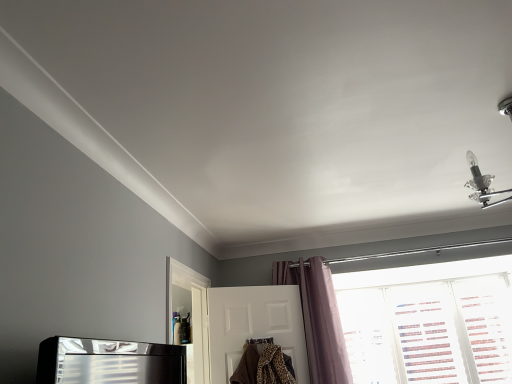
This screenshot has height=384, width=512. What do you see at coordinates (188, 316) in the screenshot?
I see `transparent plastic screen door at lower left` at bounding box center [188, 316].

Describe the element at coordinates (254, 326) in the screenshot. This screenshot has height=384, width=512. I see `white matte door at center` at that location.

Where is `transparent plastic screen door at lower left`? The height and width of the screenshot is (384, 512). transparent plastic screen door at lower left is located at coordinates (188, 316).

Is the depth of purple velvet curtain at center greater than that of transparent plastic screen door at lower left?

Yes, it is.

How different are the orientations of purple velvet curtain at center and transparent plastic screen door at lower left in degrees?

purple velvet curtain at center and transparent plastic screen door at lower left are facing 89.8 degrees away from each other.

Is purple velvet curtain at center situated inside transparent plastic screen door at lower left or outside?

purple velvet curtain at center cannot be found inside transparent plastic screen door at lower left.

Does purple velvet curtain at center have a smaller size compared to transparent plastic screen door at lower left?

No.

Is white matte door at center turned away from transparent plastic screen door at lower left?

No, white matte door at center's orientation is not away from transparent plastic screen door at lower left.

Which is more to the right, white matte door at center or transparent plastic screen door at lower left?

white matte door at center is more to the right.

From the image's perspective, is white matte door at center under transparent plastic screen door at lower left?

Indeed, from the image's perspective, white matte door at center is shown beneath transparent plastic screen door at lower left.

From the picture: From a real-world perspective, is white matte door at center physically located above or below white textured blinds at lower right?

white matte door at center is above white textured blinds at lower right.

How distant is white matte door at center from white textured blinds at lower right?

white matte door at center is 1.39 meters away from white textured blinds at lower right.

Does white matte door at center lie in front of white textured blinds at lower right?

That is True.

In the scene shown: From the image's perspective, is white matte door at center on white textured blinds at lower right?

Yes, from the image's perspective, white matte door at center is above white textured blinds at lower right.

At what (x,y) coordinates should I click in order to perform the action: click on window below the purple velvet curtain at center (from the image's perspective). Please return your answer as a coordinate pair (x, y). Looking at the image, I should click on (429, 322).

Could white textured blinds at lower right be considered to be inside purple velvet curtain at center?

That's incorrect, white textured blinds at lower right is not inside purple velvet curtain at center.

Is purple velvet curtain at center taller than white textured blinds at lower right?

No.

Is white matte door at center at the back of white textured blinds at lower right?

That's not correct — white textured blinds at lower right is not looking away from white matte door at center.

Considering the sizes of objects white textured blinds at lower right and white matte door at center in the image provided, who is thinner, white textured blinds at lower right or white matte door at center?

white textured blinds at lower right is thinner.

In terms of height, does white textured blinds at lower right look taller or shorter compared to white matte door at center?

Clearly, white textured blinds at lower right is taller compared to white matte door at center.

Locate an element on the screen. window below the transparent plastic screen door at lower left (from a real-world perspective) is located at coordinates (429, 322).

How different are the orientations of transparent plastic screen door at lower left and white textured blinds at lower right in degrees?

The facing directions of transparent plastic screen door at lower left and white textured blinds at lower right are 89.4 degrees apart.

Looking at the image, does transparent plastic screen door at lower left seem bigger or smaller compared to white textured blinds at lower right?

transparent plastic screen door at lower left is smaller than white textured blinds at lower right.

Is transparent plastic screen door at lower left not within white textured blinds at lower right?

Yes, transparent plastic screen door at lower left is not within white textured blinds at lower right.

Does white textured blinds at lower right appear on the left side of purple velvet curtain at center?

In fact, white textured blinds at lower right is to the right of purple velvet curtain at center.

The height and width of the screenshot is (384, 512). Identify the location of window on the right side of purple velvet curtain at center. (429, 322).

Is white textured blinds at lower right completely or partially outside of purple velvet curtain at center?

That's correct, white textured blinds at lower right is outside of purple velvet curtain at center.

Which of these two, white textured blinds at lower right or purple velvet curtain at center, is bigger?

purple velvet curtain at center.

The width and height of the screenshot is (512, 384). In order to click on curtain on the right of the transparent plastic screen door at lower left in this screenshot , I will do `click(318, 318)`.

Where is `screen door on the left of white matte door at center`? The width and height of the screenshot is (512, 384). screen door on the left of white matte door at center is located at coordinates (188, 316).

From the image, which object appears to be nearer to purple velvet curtain at center, transparent plastic screen door at lower left or white textured blinds at lower right?

transparent plastic screen door at lower left is closer to purple velvet curtain at center.

Considering their positions, is white matte door at center positioned closer to purple velvet curtain at center than white textured blinds at lower right?

white matte door at center is closer to purple velvet curtain at center.

Estimate the real-world distances between objects in this image. Which object is closer to white textured blinds at lower right, purple velvet curtain at center or transparent plastic screen door at lower left?

purple velvet curtain at center is positioned closer to the anchor white textured blinds at lower right.

Based on their spatial positions, is white textured blinds at lower right or white matte door at center closer to purple velvet curtain at center?

Based on the image, white matte door at center appears to be nearer to purple velvet curtain at center.

Looking at the image, which one is located further to transparent plastic screen door at lower left, white textured blinds at lower right or white matte door at center?

white textured blinds at lower right lies further to transparent plastic screen door at lower left than the other object.

Looking at the image, which one is located further to white textured blinds at lower right, transparent plastic screen door at lower left or purple velvet curtain at center?

transparent plastic screen door at lower left is further to white textured blinds at lower right.

Which object lies further to the anchor point transparent plastic screen door at lower left, purple velvet curtain at center or white matte door at center?

purple velvet curtain at center.

From the image, which object appears to be farther from transparent plastic screen door at lower left, white textured blinds at lower right or purple velvet curtain at center?

Result: Among the two, white textured blinds at lower right is located further to transparent plastic screen door at lower left.

Image resolution: width=512 pixels, height=384 pixels. I want to click on curtain between transparent plastic screen door at lower left and white textured blinds at lower right, so click(x=318, y=318).

This screenshot has width=512, height=384. I want to click on door between transparent plastic screen door at lower left and purple velvet curtain at center in the horizontal direction, so click(x=254, y=326).

At what (x,y) coordinates should I click in order to perform the action: click on curtain situated between white matte door at center and white textured blinds at lower right from left to right. Please return your answer as a coordinate pair (x, y). The width and height of the screenshot is (512, 384). Looking at the image, I should click on (318, 318).

The height and width of the screenshot is (384, 512). Find the location of `door between transparent plastic screen door at lower left and white textured blinds at lower right in the horizontal direction`. door between transparent plastic screen door at lower left and white textured blinds at lower right in the horizontal direction is located at coordinates (254, 326).